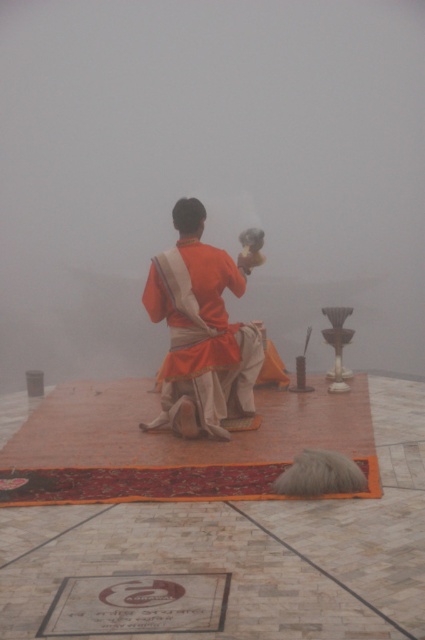
Question: Is the position of foggy mist at center less distant than that of matte orange robe at center?

Choices:
 (A) no
 (B) yes

Answer: (A)

Question: Where is foggy mist at center located in relation to matte orange robe at center in the image?

Choices:
 (A) left
 (B) right

Answer: (B)

Question: Which object appears farthest from the camera in this image?

Choices:
 (A) foggy mist at center
 (B) matte orange robe at center

Answer: (A)

Question: Observing the image, what is the correct spatial positioning of foggy mist at center in reference to matte orange robe at center?

Choices:
 (A) right
 (B) left

Answer: (A)